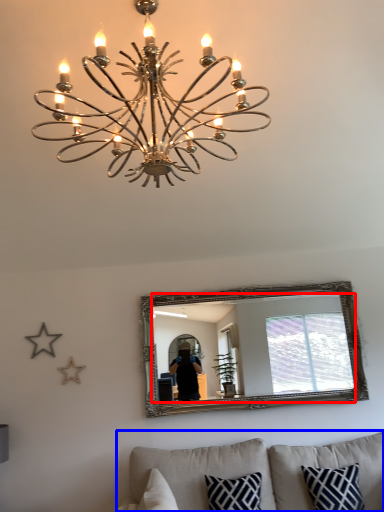
Question: Among these objects, which one is nearest to the camera, mirror (highlighted by a red box) or studio couch (highlighted by a blue box)?

Choices:
 (A) mirror
 (B) studio couch

Answer: (B)